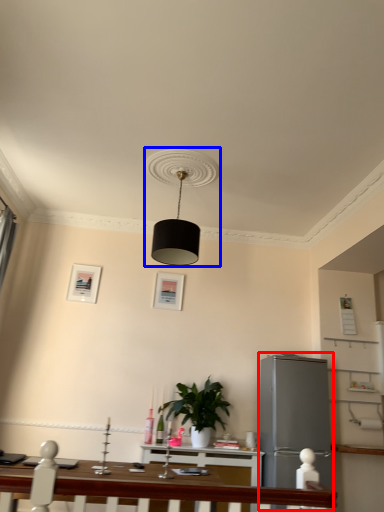
Question: Which object is closer to the camera taking this photo, appliance (highlighted by a red box) or lamp (highlighted by a blue box)?

Choices:
 (A) appliance
 (B) lamp

Answer: (B)